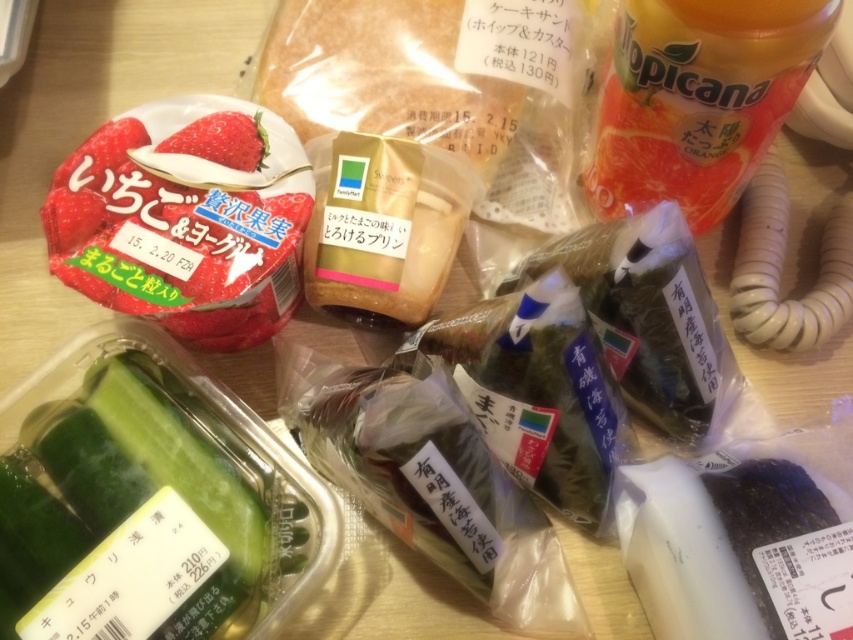
You are organizing items on a table and need to place a new item between the orange plastic bottle at upper right and the matte white strawberry at upper center. Can you fit it there if the item is 10 inches long?

The distance between the orange plastic bottle at upper right and the matte white strawberry at upper center is 22.19 inches. Since the new item is only 10 inches long, there is enough space to place it between them.